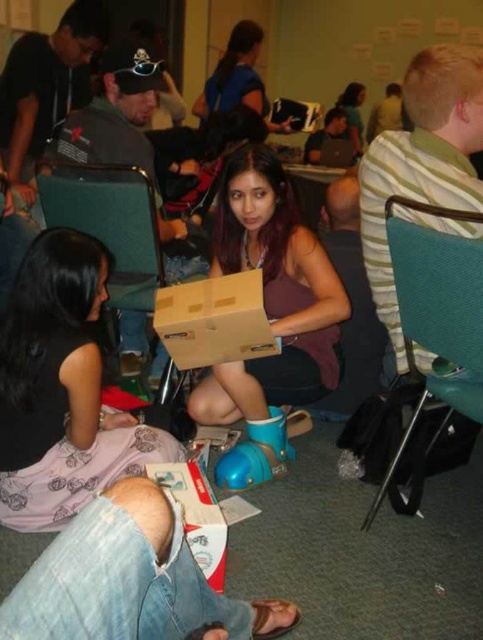
Is matte cardboard box at center thinner than matte brown hair at upper center?

Incorrect, matte cardboard box at center's width is not less than matte brown hair at upper center's.

Who is lower down, matte cardboard box at center or matte brown hair at upper center?

matte cardboard box at center is lower down.

Is point (230, 230) positioned before point (349, 96)?

Yes, it is.

Locate an element on the screen. Image resolution: width=483 pixels, height=640 pixels. matte cardboard box at center is located at coordinates (271, 301).

Which of these two, teal fabric chair at right or matte brown hair at upper center, stands shorter?

With less height is matte brown hair at upper center.

From the picture: Can you confirm if teal fabric chair at right is thinner than matte brown hair at upper center?

No, teal fabric chair at right is not thinner than matte brown hair at upper center.

Find the location of a particular element. teal fabric chair at right is located at coordinates (437, 314).

Can you confirm if brown cardboard box at center is positioned below matte brown hair at upper center?

Yes.

Which is in front, point (249, 321) or point (353, 116)?

Point (249, 321) is in front.

Between point (221, 342) and point (356, 108), which one is positioned behind?

Point (356, 108)

At what (x,y) coordinates should I click in order to perform the action: click on brown cardboard box at center. Please return your answer as a coordinate pair (x, y). Image resolution: width=483 pixels, height=640 pixels. Looking at the image, I should click on (213, 321).